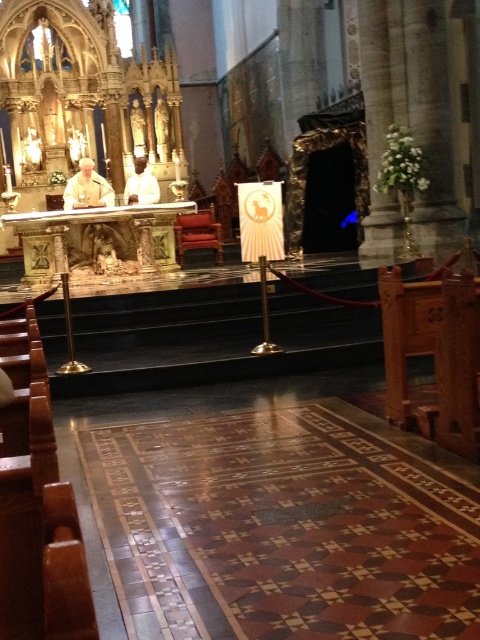
Which is above, matte white robe at center or white cloth at center?

white cloth at center

Between matte white robe at center and white cloth at center, which one appears on the left side from the viewer's perspective?

matte white robe at center is more to the left.

Is point (63, 196) closer to camera compared to point (144, 188)?

Yes, point (63, 196) is closer to viewer.

Find the location of `matte white robe at center`. matte white robe at center is located at coordinates (87, 188).